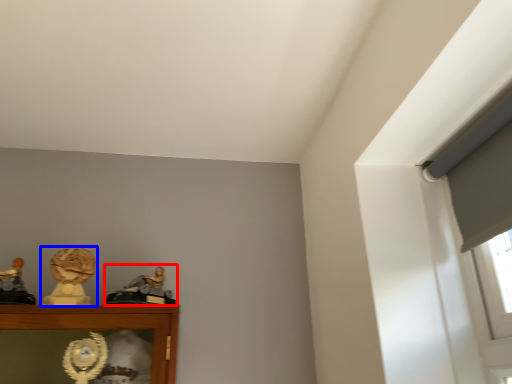
Question: Which point is further to the camera, character sculpture (highlighted by a red box) or character sculpture (highlighted by a blue box)?

Choices:
 (A) character sculpture
 (B) character sculpture

Answer: (B)